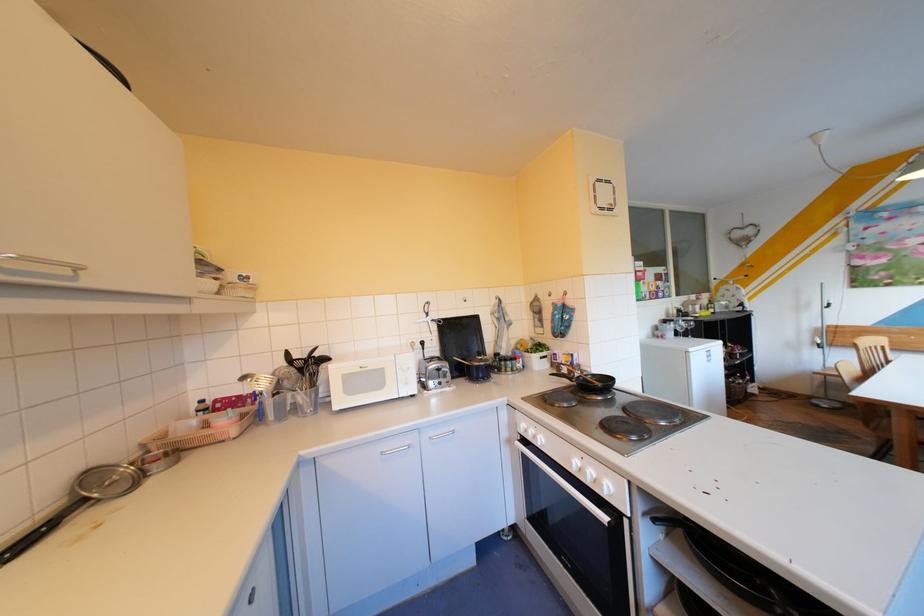
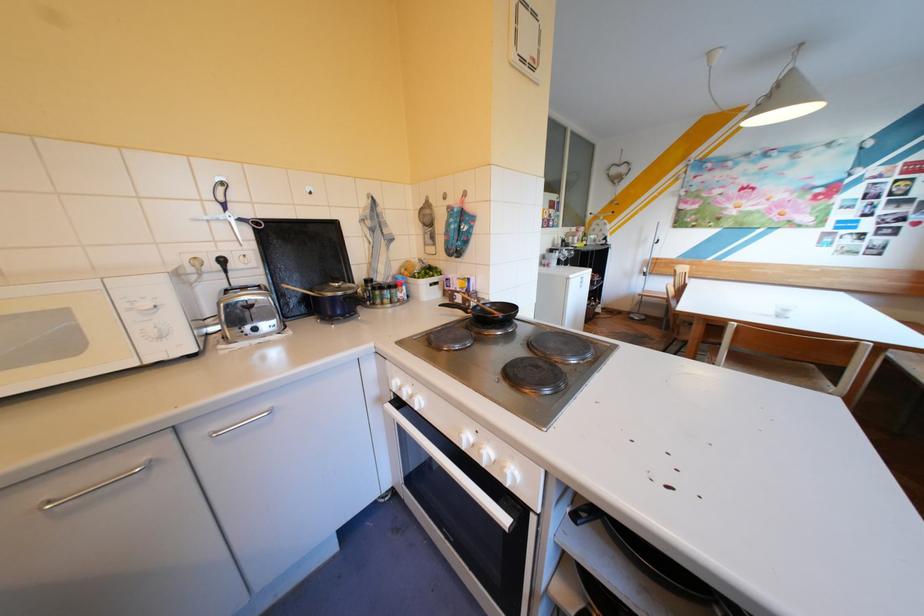
Locate, in the second image, the point that corresponds to the point at 535,435 in the first image.

(407, 392)